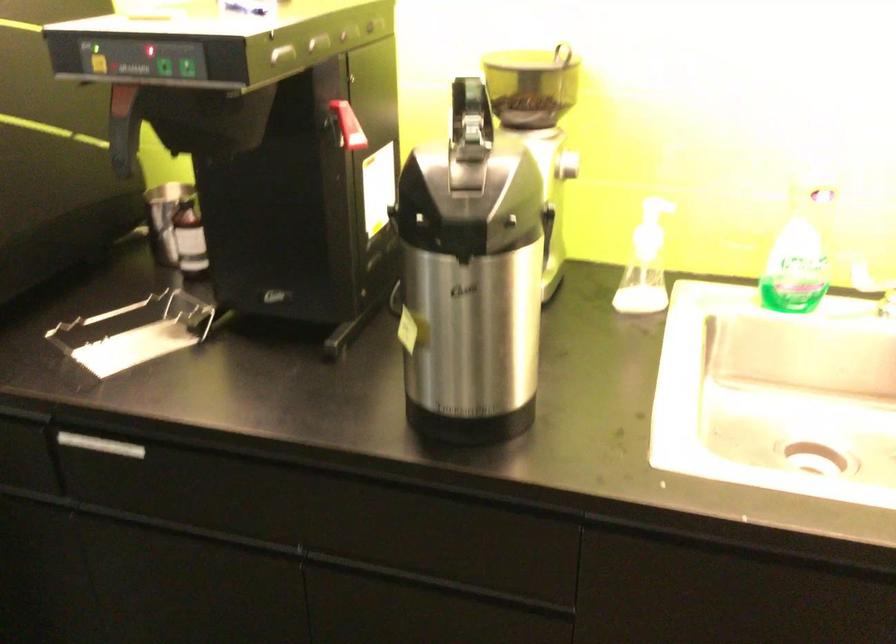
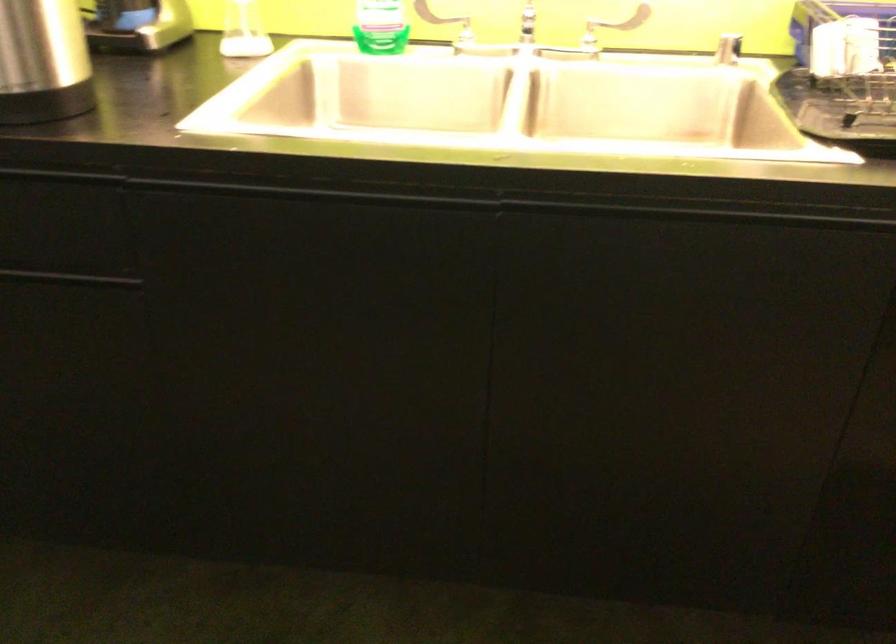
Find the pixel in the second image that matches point 797,279 in the first image.

(381, 26)